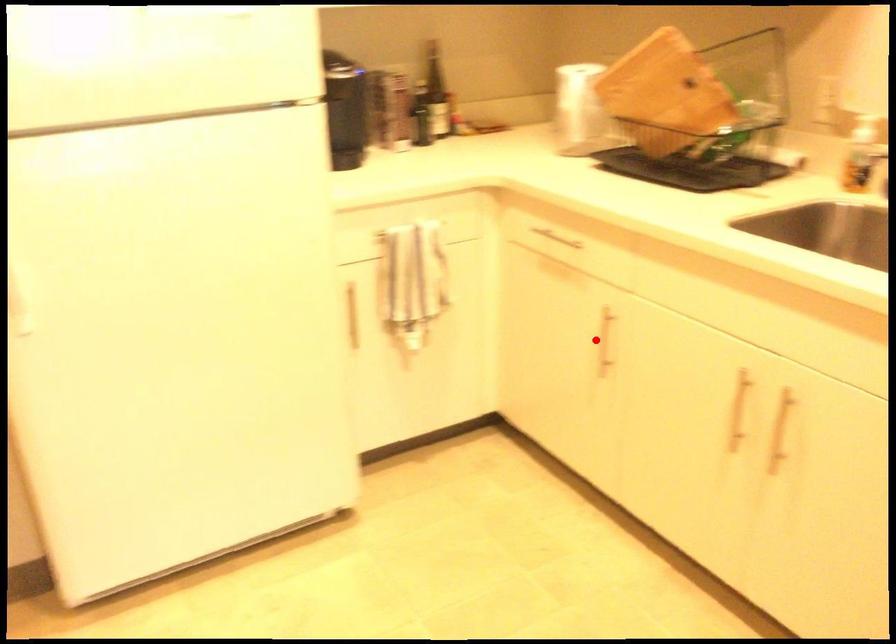
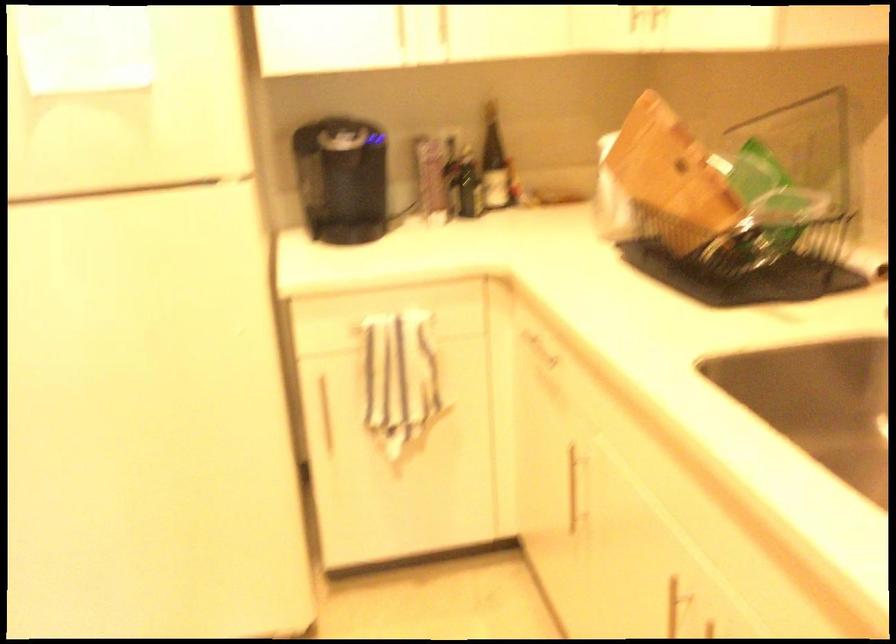
Question: I am providing you with two images of the same scene from different viewpoints. Image1 has a red point marked. In image2, the corresponding 3D location appears at what relative position? Reply with the corresponding letter.

Choices:
 (A) Closer
 (B) Farther

Answer: (A)